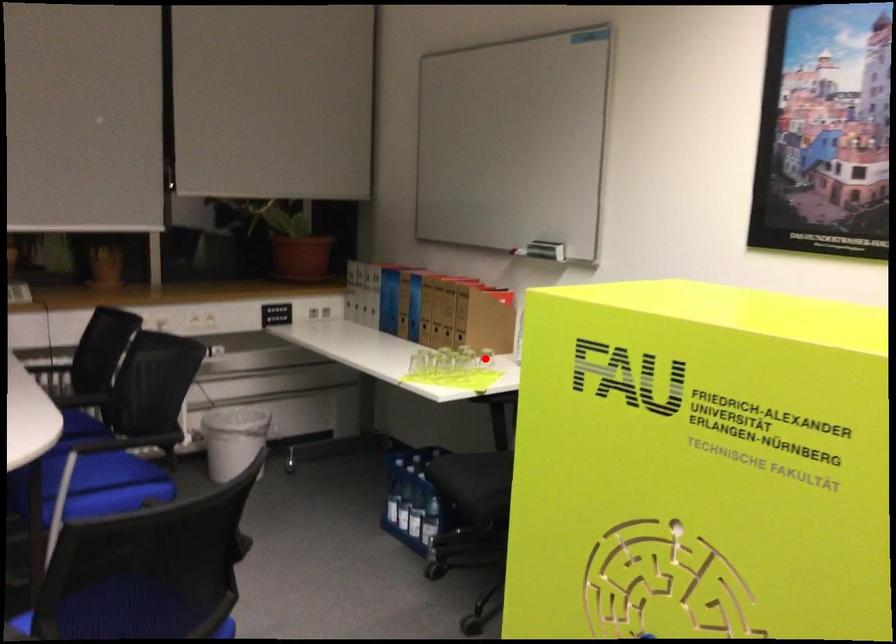
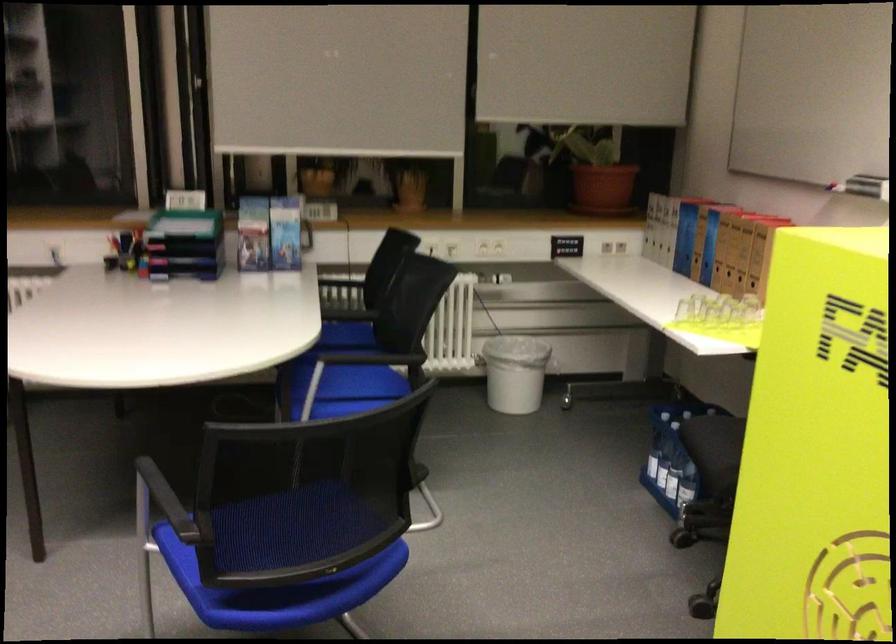
Question: I am providing you with two images of the same scene from different viewpoints. A red point is marked on the first image. Can you still see the location of the red point in image 2?

Choices:
 (A) Yes
 (B) No

Answer: (B)